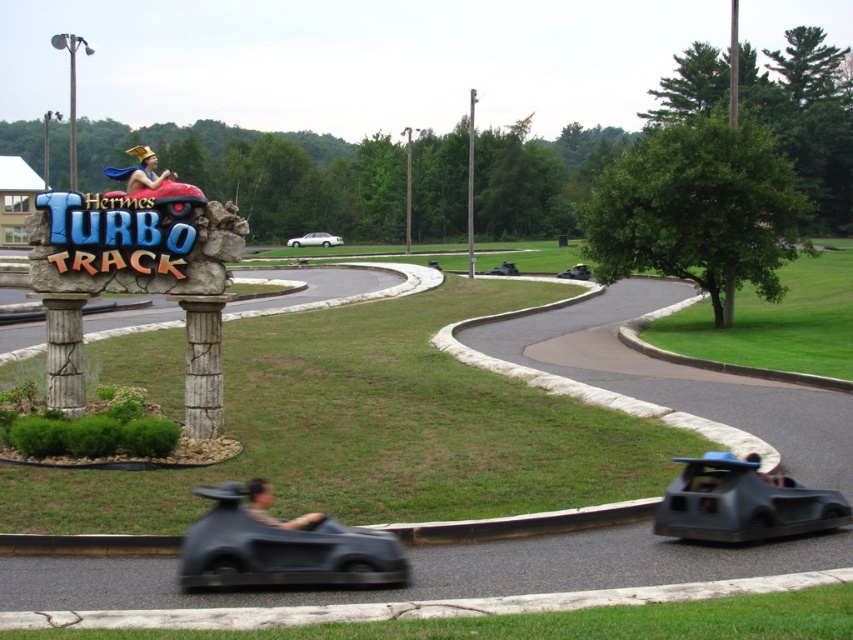
You are a go kart racer at the Hermes Turbo Track. You are currently at point [260,484] and want to reach the starting line located at point [321,232]. Is the starting line behind you or in front of you?

The starting line at point [321,232] is behind you because point [260,484] is in front of it.